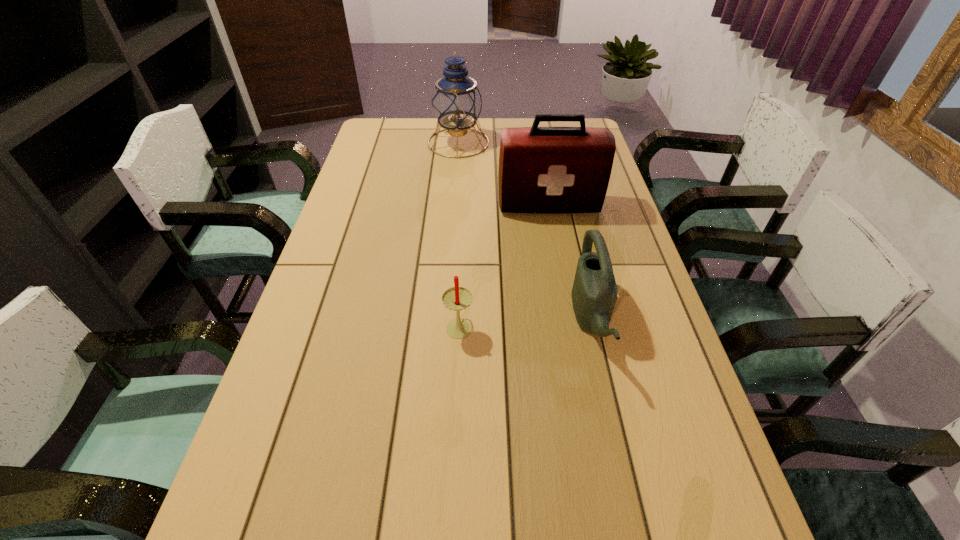
You are a GUI agent. You are given a task and a screenshot of the screen. Output one action in this format:
    pyautogui.click(x=<x>, y=<y>)
    Task: Click on the lantern
    This screenshot has height=540, width=960.
    Given the screenshot: What is the action you would take?
    pyautogui.click(x=456, y=102)

Locate an element on the screen. the first aid kit is located at coordinates (542, 170).

Locate an element on the screen. watering can is located at coordinates (594, 293).

Where is `candle`? candle is located at coordinates (457, 298).

Locate an element on the screen. The image size is (960, 540). free point located on the front-facing side of the lantern is located at coordinates (510, 143).

At what (x,y) coordinates should I click in order to perform the action: click on vacant position located 0.150m on the side of the first aid kit with the cross symbol. Please return your answer as a coordinate pair (x, y). This screenshot has width=960, height=540. Looking at the image, I should click on (557, 251).

At what (x,y) coordinates should I click in order to perform the action: click on vacant space situated on the spout of the watering can. Please return your answer as a coordinate pair (x, y). The height and width of the screenshot is (540, 960). Looking at the image, I should click on (474, 320).

Find the location of a particular element. This screenshot has width=960, height=540. vacant space located 0.060m on the spout of the watering can is located at coordinates (549, 320).

Locate an element on the screen. The image size is (960, 540). vacant space positioned on the spout of the watering can is located at coordinates (533, 320).

The width and height of the screenshot is (960, 540). Find the location of `free spot located on the right of the candle`. free spot located on the right of the candle is located at coordinates (596, 326).